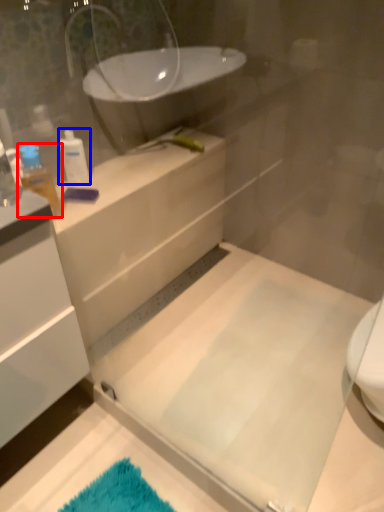
Question: Among these objects, which one is nearest to the camera, toiletry (highlighted by a red box) or toiletry (highlighted by a blue box)?

Choices:
 (A) toiletry
 (B) toiletry

Answer: (A)